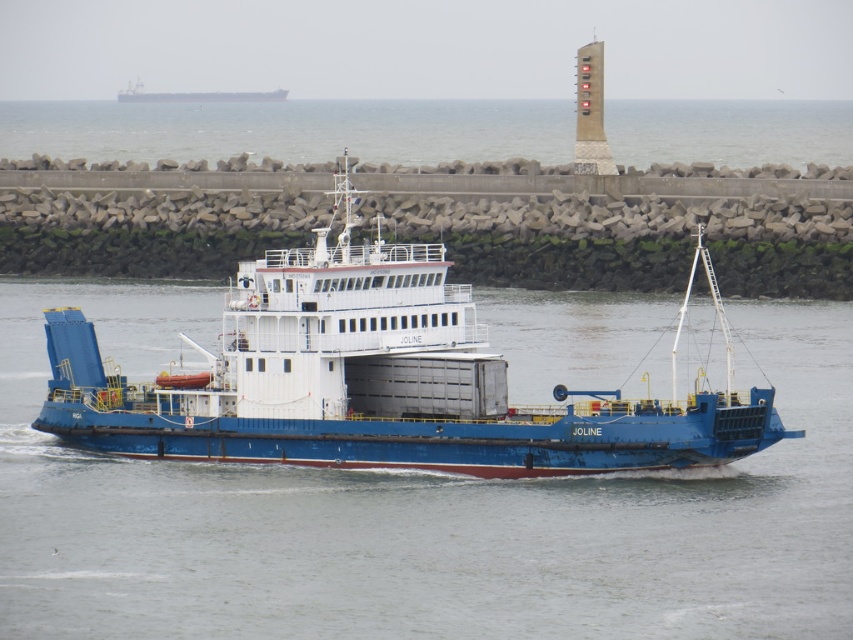
Is blue metallic water at center to the left of blue matte cargo ship at center from the viewer's perspective?

Correct, you'll find blue metallic water at center to the left of blue matte cargo ship at center.

Can you confirm if blue metallic water at center is taller than blue matte cargo ship at center?

No, blue metallic water at center is not taller than blue matte cargo ship at center.

Is point (119, 486) more distant than point (321, 241)?

No, (119, 486) is closer to viewer.

You are a GUI agent. You are given a task and a screenshot of the screen. Output one action in this format:
    pyautogui.click(x=<x>, y=<y>)
    Task: Click on the blue metallic water at center
    The image size is (853, 640).
    Given the screenshot: What is the action you would take?
    pyautogui.click(x=416, y=515)

Who is positioned more to the left, blue metallic water at center or blue matte cargo ship at upper left?

From the viewer's perspective, blue matte cargo ship at upper left appears more on the left side.

Can you confirm if blue metallic water at center is bigger than blue matte cargo ship at upper left?

Correct, blue metallic water at center is larger in size than blue matte cargo ship at upper left.

Where is `blue metallic water at center`? blue metallic water at center is located at coordinates (416, 515).

Can you confirm if blue metallic water at center is taller than gray concrete water at center?

No, blue metallic water at center is not taller than gray concrete water at center.

Does blue metallic water at center appear over gray concrete water at center?

No, blue metallic water at center is not above gray concrete water at center.

Which is behind, point (711, 516) or point (67, 156)?

The point (67, 156) is more distant.

The height and width of the screenshot is (640, 853). Find the location of `blue metallic water at center`. blue metallic water at center is located at coordinates (416, 515).